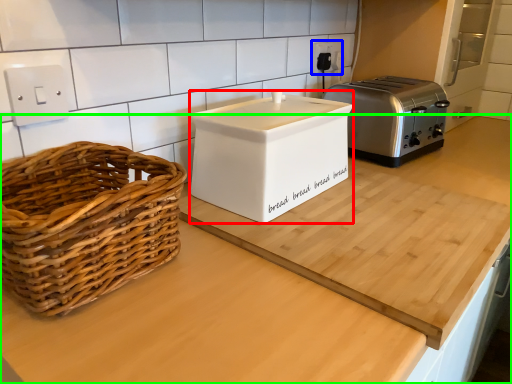
Question: Estimate the real-world distances between objects in this image. Which object is closer to appliance (highlighted by a red box), electric outlet (highlighted by a blue box) or countertop (highlighted by a green box)?

Choices:
 (A) electric outlet
 (B) countertop

Answer: (B)